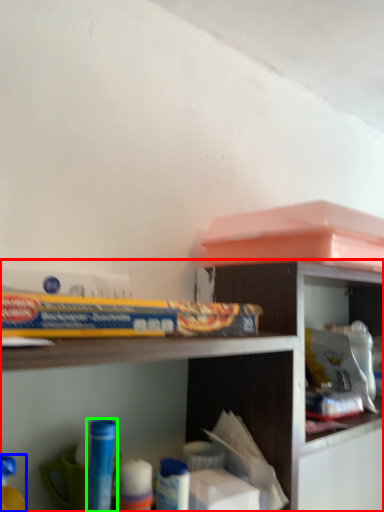
Question: Considering the real-world distances, which object is farthest from shelf (highlighted by a red box)? toy (highlighted by a blue box) or toy (highlighted by a green box)?

Choices:
 (A) toy
 (B) toy

Answer: (A)